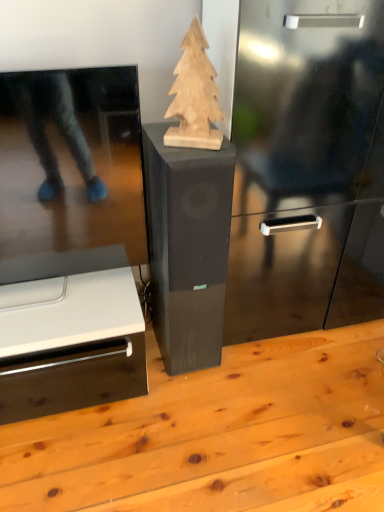
Question: From the image's perspective, is light brown wood table at center located above or below natural wood christmas tree at center?

Choices:
 (A) below
 (B) above

Answer: (A)

Question: Is light brown wood table at center inside or outside of natural wood christmas tree at center?

Choices:
 (A) inside
 (B) outside

Answer: (B)

Question: Estimate the real-world distances between objects in this image. Which object is closer to the black wood speaker at center?

Choices:
 (A) light brown wood table at center
 (B) natural wood christmas tree at center

Answer: (B)

Question: Which of these objects is positioned closest to the black wood speaker at center?

Choices:
 (A) light brown wood table at center
 (B) natural wood christmas tree at center

Answer: (B)